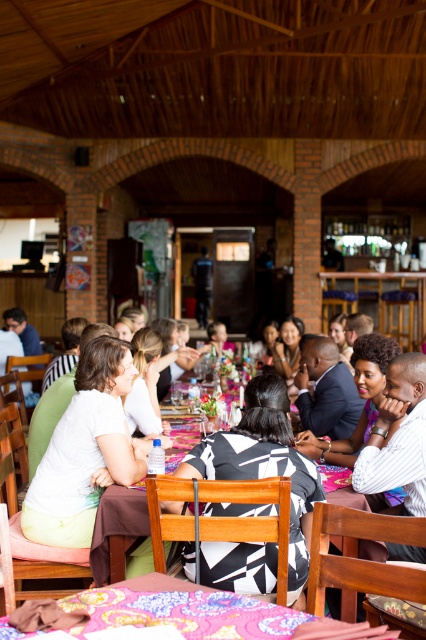
Question: Does floral fabric tablecloth at lower center have a smaller size compared to wooden table at center?

Choices:
 (A) yes
 (B) no

Answer: (A)

Question: Which point is farther to the camera?

Choices:
 (A) (121, 604)
 (B) (268, 396)

Answer: (B)

Question: Does floral fabric tablecloth at lower center appear on the right side of wooden table at center?

Choices:
 (A) no
 (B) yes

Answer: (A)

Question: Which point is closer to the camera?

Choices:
 (A) wooden table at center
 (B) floral fabric tablecloth at lower center

Answer: (B)

Question: Does floral fabric tablecloth at lower center appear on the left side of wooden table at center?

Choices:
 (A) yes
 (B) no

Answer: (A)